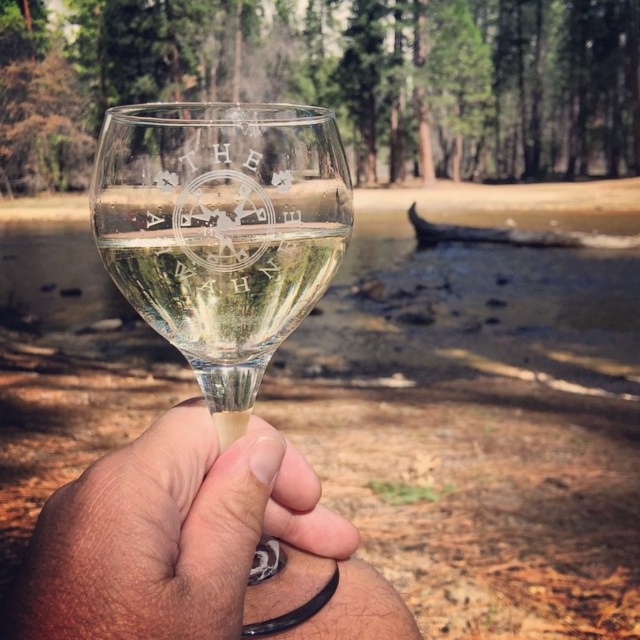
Question: Which point is farther from the camera taking this photo?

Choices:
 (A) (156, 262)
 (B) (291, 234)

Answer: (B)

Question: Can you confirm if translucent glass at center is positioned to the right of clear glass wine at center?

Choices:
 (A) yes
 (B) no

Answer: (A)

Question: Does translucent glass at center appear under clear glass wine glass at center?

Choices:
 (A) no
 (B) yes

Answer: (B)

Question: Which of these objects is positioned farthest from the clear glass wine glass at center?

Choices:
 (A) translucent glass at center
 (B) clear glass wine at center

Answer: (A)

Question: Which of the following is the closest to the observer?

Choices:
 (A) clear glass wine at center
 (B) clear glass wine glass at center
 (C) translucent glass at center

Answer: (C)

Question: Does clear glass wine glass at center appear over clear glass wine at center?

Choices:
 (A) no
 (B) yes

Answer: (A)